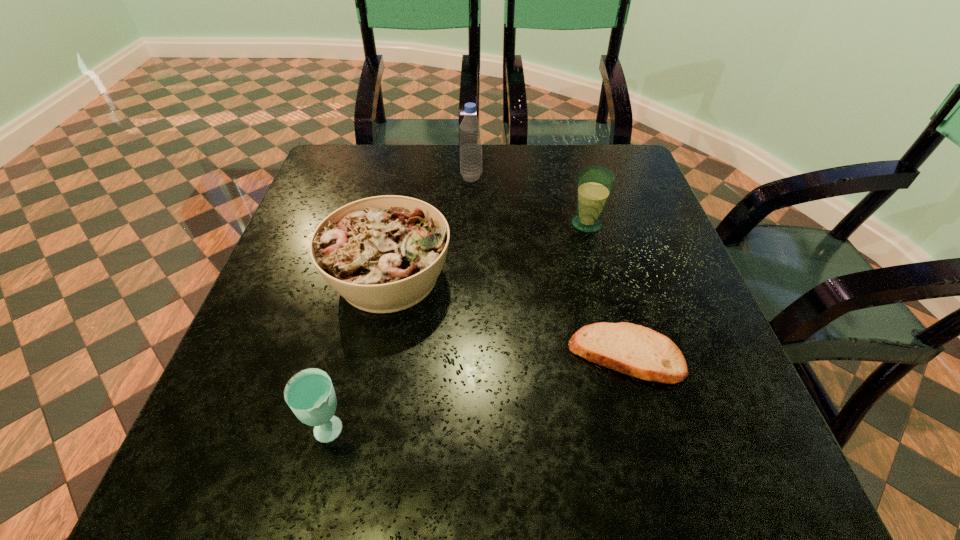
Where is `vacant area that lies between the farther glass and the tallest object`? vacant area that lies between the farther glass and the tallest object is located at coordinates (529, 200).

Identify which object is the nearest to the farthest object. Please provide its 2D coordinates. Your answer should be formatted as a tuple, i.e. [(x, y)], where the tuple contains the x and y coordinates of a point satisfying the conditions above.

[(383, 254)]

Find the location of a particular element. This screenshot has height=540, width=960. object that can be found as the closest to the bottle is located at coordinates (383, 254).